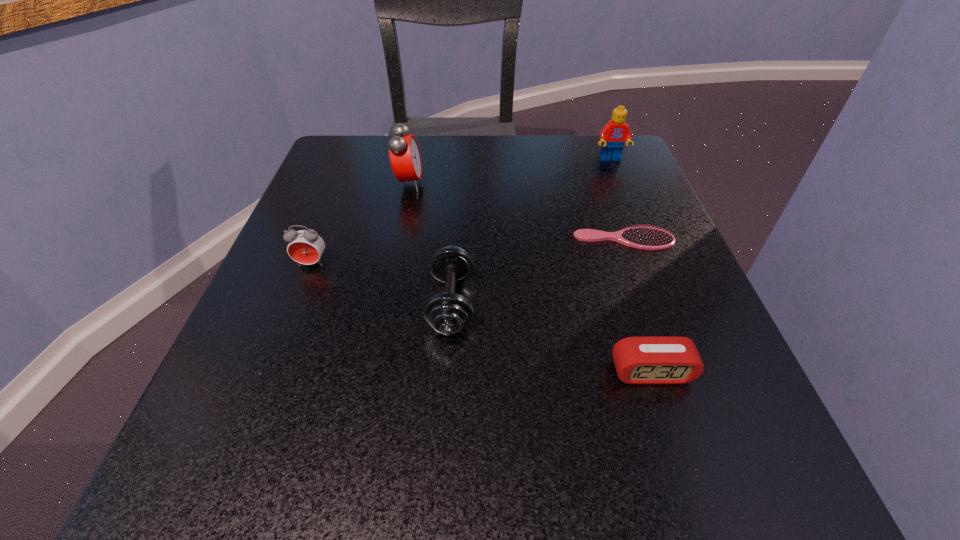
I want to click on free area in between the Lego and the second object from left to right, so click(x=510, y=171).

Locate an element on the screen. free space between the farthest object and the tallest alarm clock is located at coordinates (510, 171).

The image size is (960, 540). I want to click on free area in between the second farthest object and the fourth tallest object, so click(430, 244).

At what (x,y) coordinates should I click in order to perform the action: click on blank region between the fifth nearest object and the rightmost alarm clock. Please return your answer as a coordinate pair (x, y). Looking at the image, I should click on (530, 278).

Find the location of a particular element. This screenshot has width=960, height=540. free space between the hairbrush and the second nearest alarm clock is located at coordinates (468, 252).

I want to click on free space between the leftmost object and the fourth tallest object, so click(381, 284).

Where is `free space between the Lego and the second shortest alarm clock`? The image size is (960, 540). free space between the Lego and the second shortest alarm clock is located at coordinates (461, 212).

The image size is (960, 540). What are the coordinates of `free area in between the second farthest object and the Lego` in the screenshot? It's located at (510, 171).

This screenshot has width=960, height=540. I want to click on free spot between the shortest object and the rightmost alarm clock, so click(637, 306).

You are a GUI agent. You are given a task and a screenshot of the screen. Output one action in this format:
    pyautogui.click(x=<x>, y=<y>)
    Task: Click on the empty space that is in between the nearest object and the fourth object from right to left
    
    Given the screenshot: What is the action you would take?
    pyautogui.click(x=551, y=338)